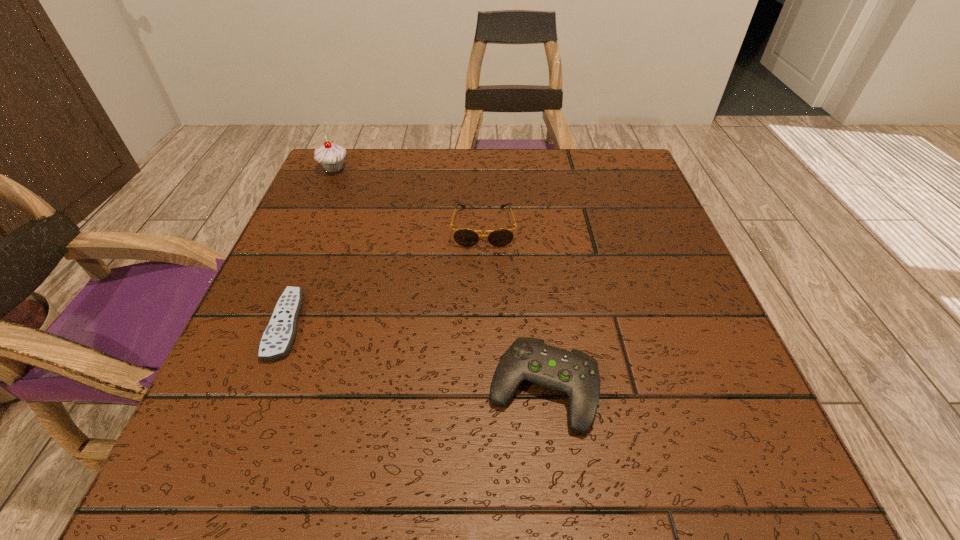
Find the location of a particular element. vacant space in between the second farthest object and the control is located at coordinates (514, 308).

The height and width of the screenshot is (540, 960). Identify the location of empty space that is in between the control and the shortest object. (415, 357).

In order to click on free space between the control and the shortest object in this screenshot , I will do `click(415, 357)`.

The width and height of the screenshot is (960, 540). In order to click on vacant area that lies between the control and the farthest object in this screenshot , I will do `click(439, 279)`.

The width and height of the screenshot is (960, 540). I want to click on blank region between the farthest object and the shortest object, so click(310, 247).

The height and width of the screenshot is (540, 960). I want to click on free space between the control and the farthest object, so click(439, 279).

Find the location of a particular element. Image resolution: width=960 pixels, height=540 pixels. vacant space in between the tallest object and the shortest object is located at coordinates (310, 247).

I want to click on free space between the remote control and the tallest object, so click(310, 247).

Locate an element on the screen. unoccupied position between the third nearest object and the cupcake is located at coordinates (409, 198).

Where is `unoccupied area between the control and the shortest object`? The image size is (960, 540). unoccupied area between the control and the shortest object is located at coordinates (415, 357).